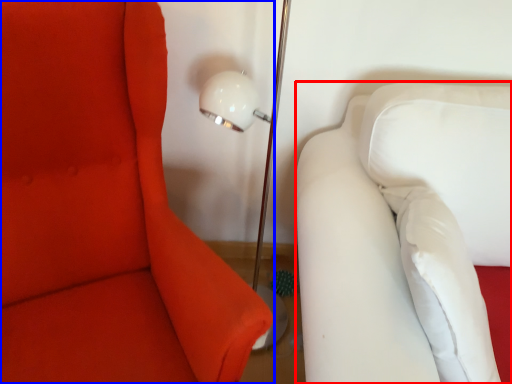
Question: Which point is further to the camera, furniture (highlighted by a red box) or furniture (highlighted by a blue box)?

Choices:
 (A) furniture
 (B) furniture

Answer: (A)